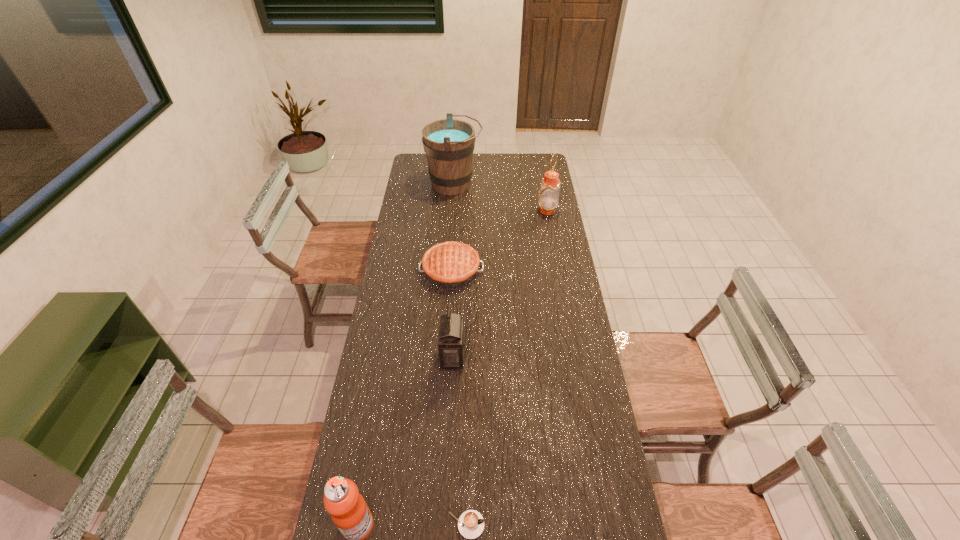
You are a GUI agent. You are given a task and a screenshot of the screen. Output one action in this format:
    pyautogui.click(x=<x>, y=<y>)
    Task: Click on the farthest object
    This screenshot has height=540, width=960.
    Given the screenshot: What is the action you would take?
    pyautogui.click(x=449, y=143)

Locate an element on the screen. oil lamp is located at coordinates (549, 191).

At what (x,y) coordinates should I click in order to perform the action: click on the fifth nearest object. Please return your answer as a coordinate pair (x, y). The image size is (960, 540). Looking at the image, I should click on (549, 191).

Locate an element on the screen. The width and height of the screenshot is (960, 540). lantern is located at coordinates (451, 335).

The height and width of the screenshot is (540, 960). What are the coordinates of `the fifth tallest object` in the screenshot? It's located at (451, 264).

Identify the location of pie. (451, 264).

Identify the location of cappuccino. (471, 523).

Identify the location of free location located with a handle on the side of the wine bucket. (509, 184).

Locate an element on the screen. free space located 0.390m on the left of the second farthest object is located at coordinates [x=458, y=210].

Locate an element on the screen. vacant space located 0.170m on the front-facing side of the lantern is located at coordinates (514, 358).